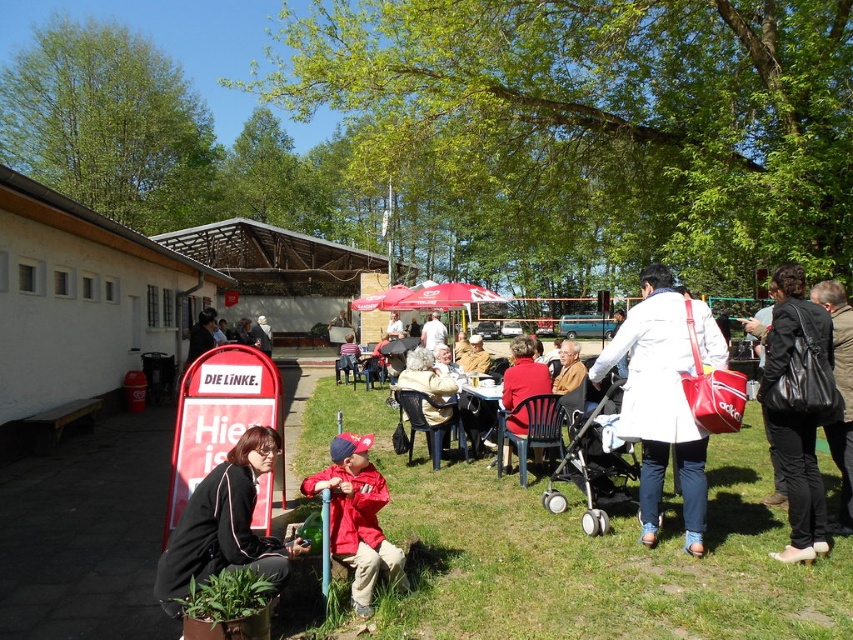
You are a photographer setting up a tripod at the event. You want to capture both the red matte jacket at lower center and the wooden picnic table at center in the same frame. The tripod has a maximum reach of 3 meters. Can you position yourself so that both objects are within the camera view without moving the tripod?

The red matte jacket at lower center and wooden picnic table at center are 3.21 meters apart from each other. Since the tripod has a maximum reach of 3 meters, the distance between the two objects exceeds the tripod reach. Therefore, you cannot capture both objects in the same frame without moving the tripod.

You are a photographer trying to capture a photo of the silver metallic stroller at center and the red fabric coat at center. Which object should you focus on first if you want to ensure both are in focus without moving the camera?

You should focus on the silver metallic stroller at center first because it is located below the red fabric coat at center, meaning it is closer to the camera. By focusing on the closer object, the farther one may still be within the depth of field, ensuring both are in focus.

You are standing at the center of the park and want to find the red matte jacket at lower center. According to the coordinates provided, in which direction should you move from your current position to locate it?

The red matte jacket at lower center is located at coordinates point [357,516]. Since you are at the center, you should move towards the lower right direction to reach it.